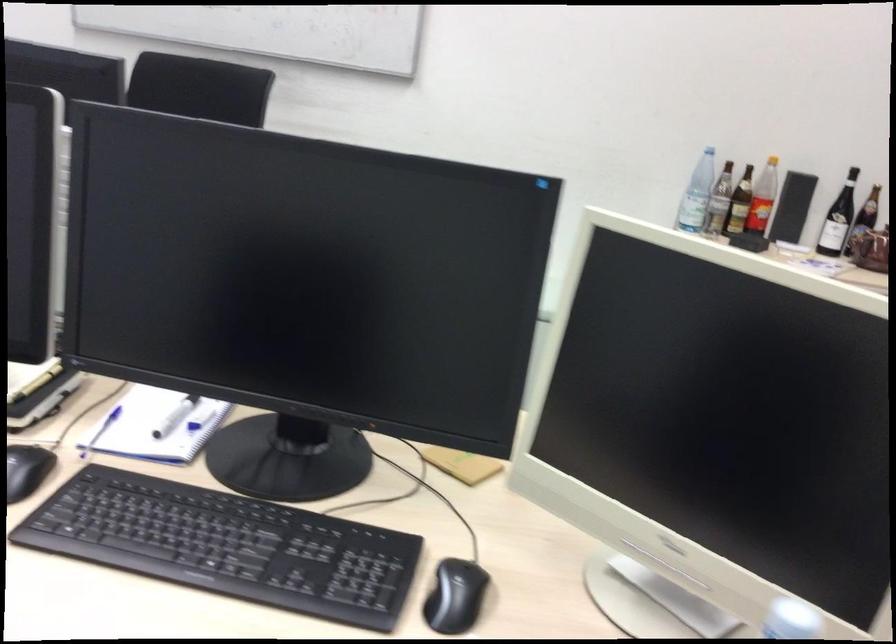
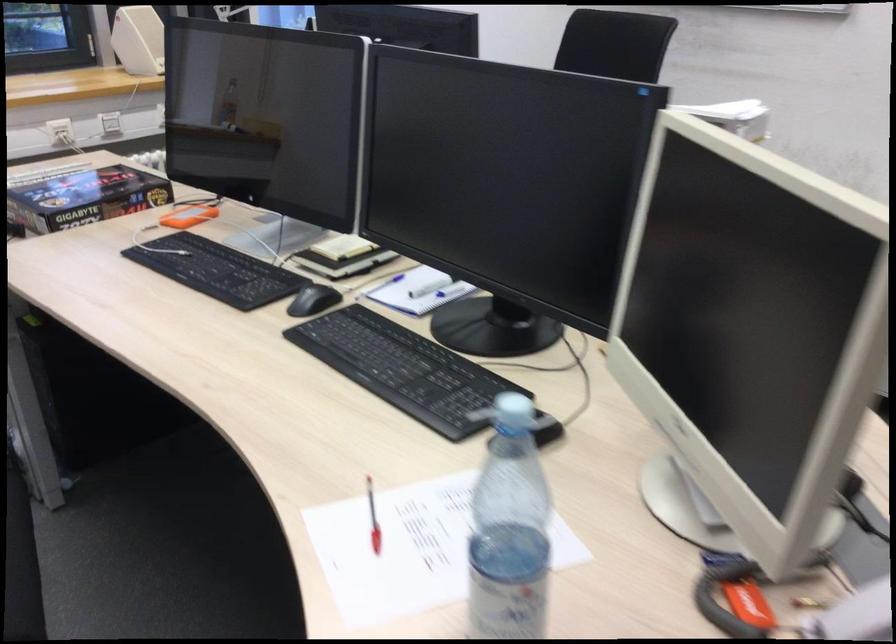
Find the pixel in the second image that matches (470,572) in the first image.

(547, 431)